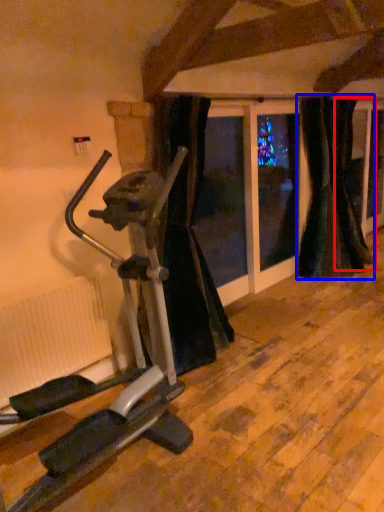
Question: Which object appears closest to the camera in this image, curtain (highlighted by a red box) or curtain (highlighted by a blue box)?

Choices:
 (A) curtain
 (B) curtain

Answer: (B)